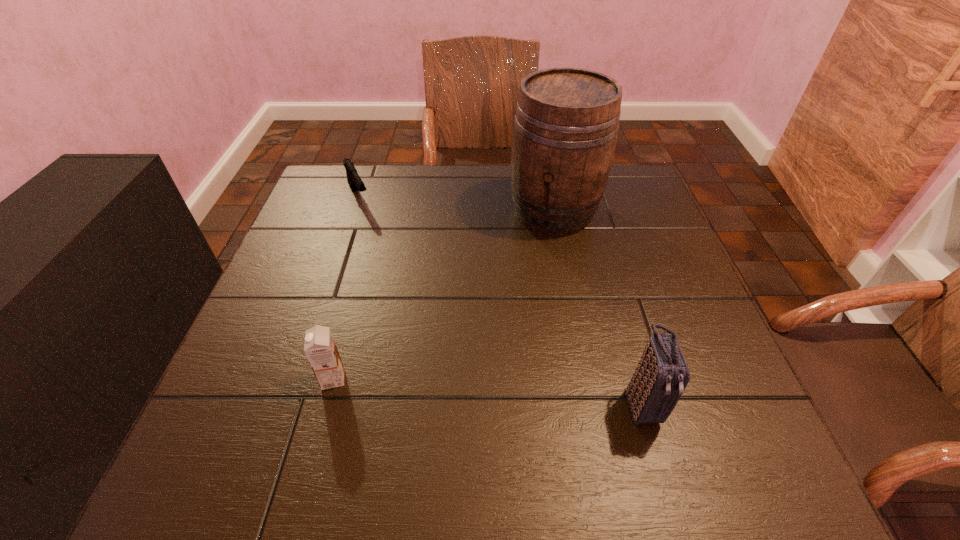
Where is `vacant area between the shortest object and the third shortest object`? Image resolution: width=960 pixels, height=540 pixels. vacant area between the shortest object and the third shortest object is located at coordinates (500, 300).

Where is `vacant area between the second tallest object and the shortest object`? The width and height of the screenshot is (960, 540). vacant area between the second tallest object and the shortest object is located at coordinates (500, 300).

Locate an element on the screen. The width and height of the screenshot is (960, 540). vacant area that lies between the cider and the pistol is located at coordinates (456, 204).

This screenshot has height=540, width=960. In order to click on free spot between the clutch bag and the pistol in this screenshot , I will do `click(500, 300)`.

Where is `empty location between the third tallest object and the tallest object`? empty location between the third tallest object and the tallest object is located at coordinates (444, 294).

This screenshot has height=540, width=960. In order to click on free space between the cider and the second shortest object in this screenshot , I will do `click(444, 294)`.

This screenshot has width=960, height=540. I want to click on empty space that is in between the chocolate milk and the tallest object, so click(444, 294).

Identify the location of free spot between the cider and the second shortest object. This screenshot has width=960, height=540. (444, 294).

Find the location of `object that is the third closest to the clutch bag`. object that is the third closest to the clutch bag is located at coordinates (354, 180).

This screenshot has width=960, height=540. In order to click on object that is the second closest one to the shortest object in this screenshot , I will do `click(320, 348)`.